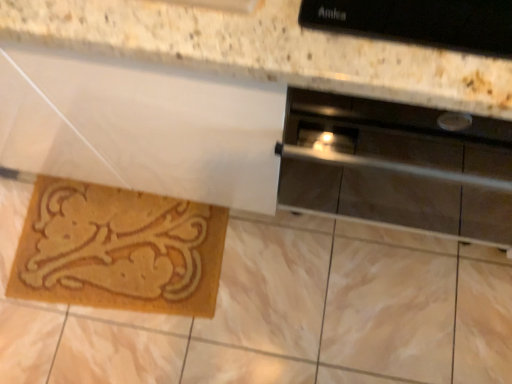
This screenshot has width=512, height=384. Identify the location of free area below natural fiber mat at lower left (from a real-world perspective). (123, 253).